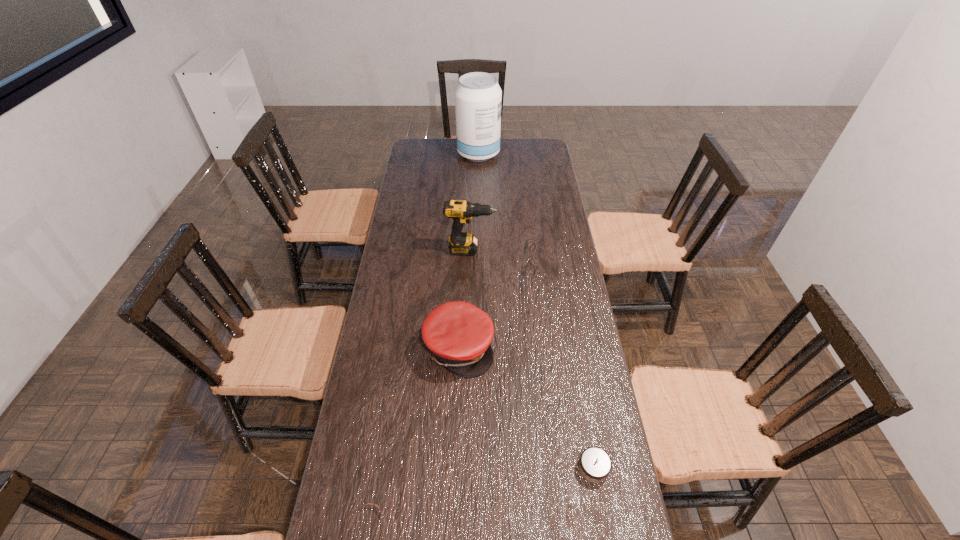
The image size is (960, 540). In order to click on vacant region located on the front-facing side of the cap in this screenshot , I will do `click(509, 347)`.

Identify the location of free location located 0.200m on the back of the chocolate cake. (580, 387).

The image size is (960, 540). What are the coordinates of `object that is positioned at the far edge` in the screenshot? It's located at (478, 97).

This screenshot has height=540, width=960. Find the location of `object situated at the right edge`. object situated at the right edge is located at coordinates (595, 464).

Where is `free space at the left edge of the desktop`? The height and width of the screenshot is (540, 960). free space at the left edge of the desktop is located at coordinates (384, 428).

Find the location of a particular element. vacant space at the right edge is located at coordinates (609, 447).

You are a GUI agent. You are given a task and a screenshot of the screen. Output one action in this format:
    pyautogui.click(x=<x>, y=<y>)
    Task: Click on the free space at the far left corner of the desktop
    The height and width of the screenshot is (540, 960).
    Given the screenshot: What is the action you would take?
    pyautogui.click(x=432, y=146)

Identify the location of vacant space at the far right corner of the desktop. (521, 147).

I want to click on vacant space that is in between the cap and the second shortest object, so click(526, 408).

Find the location of a particular element. Image resolution: width=960 pixels, height=540 pixels. vacant space in between the fourth tallest object and the fourth nearest object is located at coordinates (532, 359).